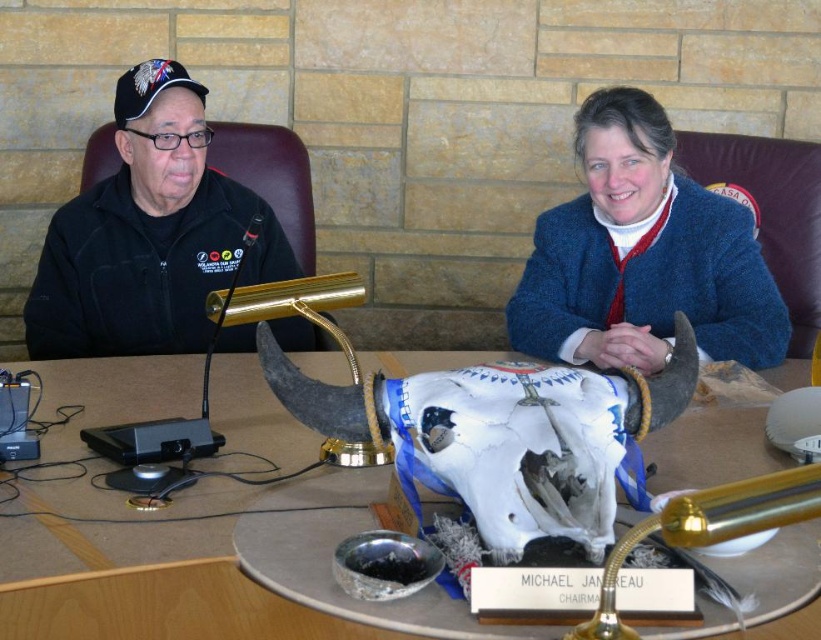
Question: Can you confirm if wooden table at center is positioned above black fleece jacket at left?

Choices:
 (A) yes
 (B) no

Answer: (B)

Question: Which of the following is the farthest from the observer?

Choices:
 (A) blue woolen sweater at upper right
 (B) wooden table at center

Answer: (A)

Question: Does blue woolen sweater at upper right come behind black fleece jacket at left?

Choices:
 (A) no
 (B) yes

Answer: (A)

Question: In this image, where is wooden table at center located relative to blue woolen sweater at upper right?

Choices:
 (A) left
 (B) right

Answer: (A)

Question: Which point appears farthest from the camera in this image?

Choices:
 (A) (x=654, y=435)
 (B) (x=580, y=314)

Answer: (B)

Question: Which of these objects is positioned closest to the wooden table at center?

Choices:
 (A) black fleece jacket at left
 (B) blue woolen sweater at upper right

Answer: (B)